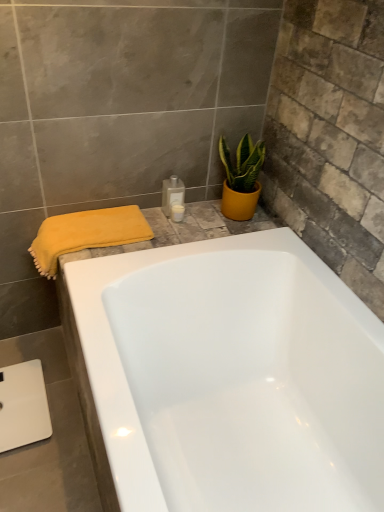
This screenshot has height=512, width=384. Identify the location of vacant space that is in between yellow matte pot at upper right and translucent plastic bottle at upper center, the first toiletry from the top. (204, 219).